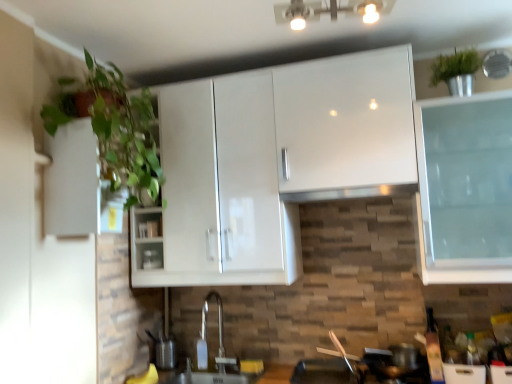
Question: Is green leafy plant at left facing away from white glossy cabinet at left?

Choices:
 (A) yes
 (B) no

Answer: (A)

Question: Is green leafy plant at left bigger than white glossy cabinet at left?

Choices:
 (A) yes
 (B) no

Answer: (A)

Question: Considering the relative sizes of green leafy plant at left and white glossy cabinet at left in the image provided, is green leafy plant at left taller than white glossy cabinet at left?

Choices:
 (A) yes
 (B) no

Answer: (A)

Question: Considering the relative sizes of green leafy plant at left and white glossy cabinet at left in the image provided, is green leafy plant at left wider than white glossy cabinet at left?

Choices:
 (A) no
 (B) yes

Answer: (B)

Question: Considering the relative positions of green leafy plant at left and white glossy cabinet at left in the image provided, is green leafy plant at left to the left of white glossy cabinet at left from the viewer's perspective?

Choices:
 (A) yes
 (B) no

Answer: (B)

Question: Considering the positions of satin silver exhaust hood at center and matte silver sink at lower center, arranged as the 2th sink when viewed from the top, in the image, is satin silver exhaust hood at center wider or thinner than matte silver sink at lower center, arranged as the 2th sink when viewed from the top,?

Choices:
 (A) thin
 (B) wide

Answer: (B)

Question: Relative to matte silver sink at lower center, arranged as the 2th sink when viewed from the top, is satin silver exhaust hood at center in front or behind?

Choices:
 (A) behind
 (B) front

Answer: (B)

Question: Based on their sizes in the image, would you say satin silver exhaust hood at center is bigger or smaller than matte silver sink at lower center, arranged as the 2th sink when viewed from the top?

Choices:
 (A) big
 (B) small

Answer: (B)

Question: Does point (359, 192) appear closer or farther from the camera than point (184, 377)?

Choices:
 (A) closer
 (B) farther

Answer: (A)

Question: Is point (82, 168) positioned closer to the camera than point (206, 372)?

Choices:
 (A) closer
 (B) farther

Answer: (A)

Question: From a real-world perspective, relative to matte silver sink at lower center, which ranks as the first sink in bottom-to-top order, is white glossy cabinet at left vertically above or below?

Choices:
 (A) above
 (B) below

Answer: (A)

Question: Looking at their shapes, would you say white glossy cabinet at left is wider or thinner than matte silver sink at lower center, arranged as the 2th sink when viewed from the top?

Choices:
 (A) wide
 (B) thin

Answer: (B)

Question: From the image's perspective, relative to matte silver sink at lower center, which ranks as the first sink in bottom-to-top order, is white glossy cabinet at left above or below?

Choices:
 (A) above
 (B) below

Answer: (A)

Question: Looking at the image, does matte silver sink at lower center, arranged as the 2th sink when viewed from the top, seem bigger or smaller compared to metallic silver toaster at center?

Choices:
 (A) small
 (B) big

Answer: (B)

Question: Considering the positions of point (174, 375) and point (158, 259), is point (174, 375) closer or farther from the camera than point (158, 259)?

Choices:
 (A) closer
 (B) farther

Answer: (B)